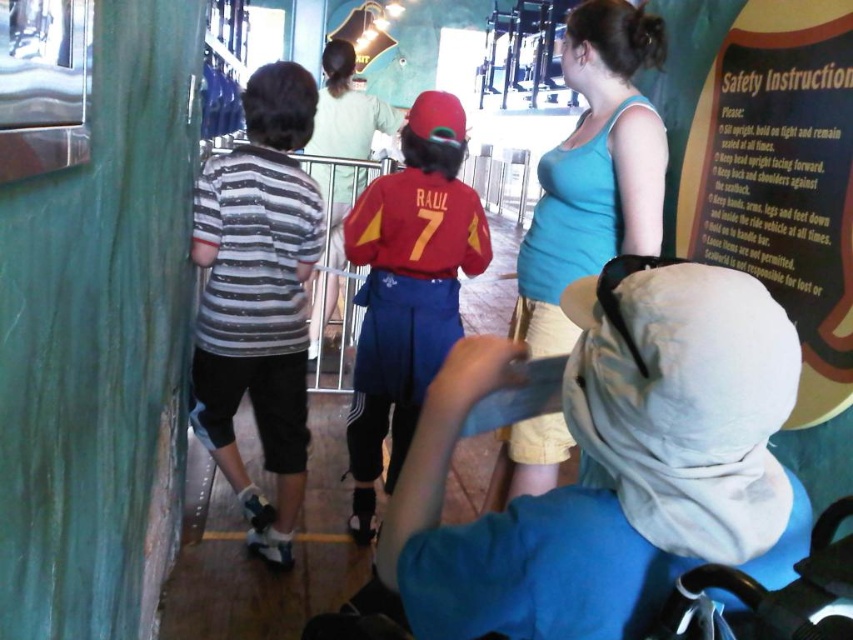
You are a visitor in the amusement park queue. You need to reach the safety instruction sign on the right. There are two obstacles in your path, a striped cotton shirt at left and a matte red cap at center. Which obstacle is taller and might block your view of the sign?

The striped cotton shirt at left is much taller than the matte red cap at center, so it might block your view of the safety instruction sign on the right.

You are standing at the entrance of the amusement park queue. You see a point marked at coordinates (258, 298). What is located at this point?

The point at coordinates (258, 298) indicates a striped cotton shirt at left.